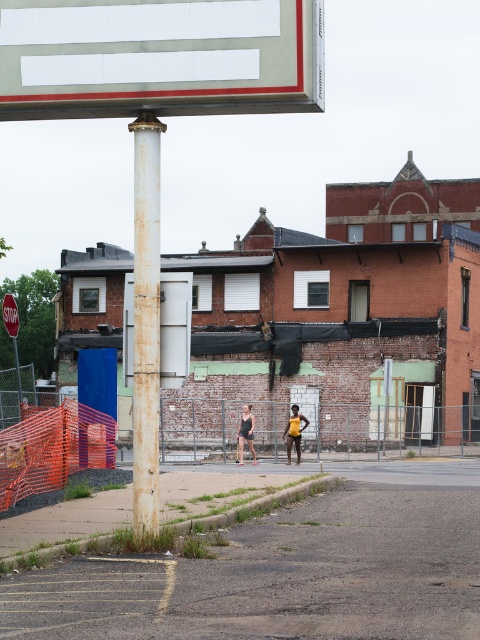
Does point (370, 502) come in front of point (241, 458)?

Yes, point (370, 502) is closer to viewer.

Is point (377, 582) farther from viewer compared to point (243, 417)?

No, (377, 582) is closer to viewer.

In order to click on smooth asphalt court at center in this screenshot , I will do `click(287, 572)`.

Does smooth asphalt court at center come in front of rusty metal pole at center?

Yes, it is in front of rusty metal pole at center.

Which is more to the left, smooth asphalt court at center or rusty metal pole at center?

rusty metal pole at center is more to the left.

Is point (363, 476) positioned after point (158, 170)?

That is True.

The height and width of the screenshot is (640, 480). I want to click on smooth asphalt court at center, so click(287, 572).

The height and width of the screenshot is (640, 480). What do you see at coordinates (287, 572) in the screenshot?
I see `smooth asphalt court at center` at bounding box center [287, 572].

Between point (383, 497) and point (297, 410), which one is positioned behind?

Point (297, 410)

Locate an element on the screen. smooth asphalt court at center is located at coordinates (287, 572).

Where is `smooth asphalt court at center`? This screenshot has width=480, height=640. smooth asphalt court at center is located at coordinates (287, 572).